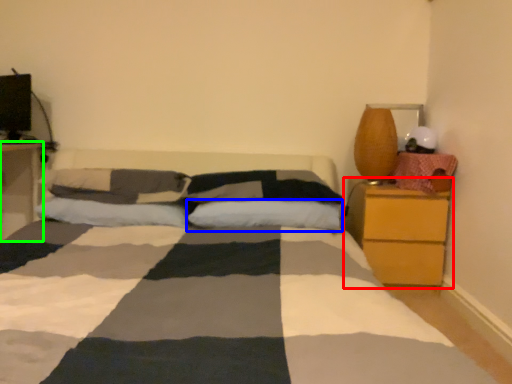
Question: Estimate the real-world distances between objects in this image. Which object is farther from nightstand (highlighted by a red box), pillow (highlighted by a blue box) or nightstand (highlighted by a green box)?

Choices:
 (A) pillow
 (B) nightstand

Answer: (B)